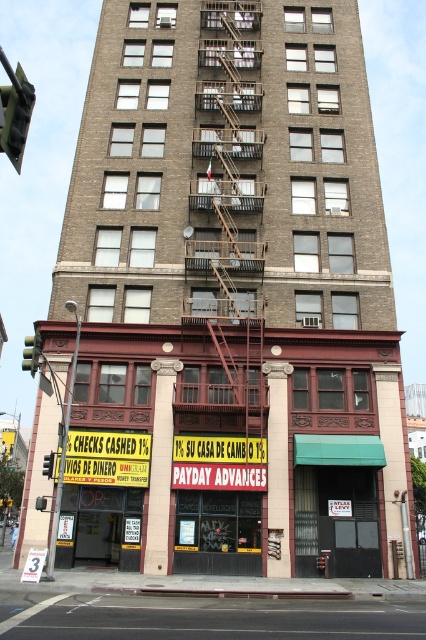
You are a pedestrian standing in front of the building. You need to read the yellow signboard at center and the green glass traffic light at left. Which object is closer to you?

The yellow signboard at center is closer to you because it is further to the viewer than the green glass traffic light at left.

You are a delivery person trying to deliver a package to the building. You notice the brown metal fire escape at center and the green glass traffic light at left. Which object is taller?

The brown metal fire escape at center is much taller than the green glass traffic light at left.

Looking at this image, you are standing in front of the building and want to determine the relative positions of two points marked on its facade. The first point is at coordinate point (189, 202) and the second is at point (31, 353). Which point is closer to you?

Point (189, 202) is further to the viewer than point (31, 353), so the point closer to you is point (31, 353).